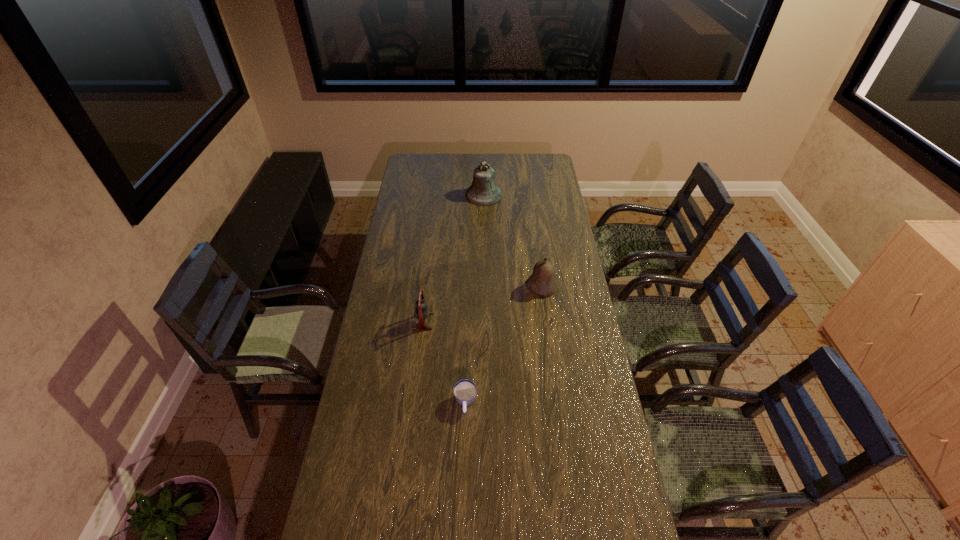
Find the location of a particular element. vacant space that satisfies the following two spatial constraints: 1. on the back side of the third farthest object; 2. on the left side of the second farthest object is located at coordinates (427, 286).